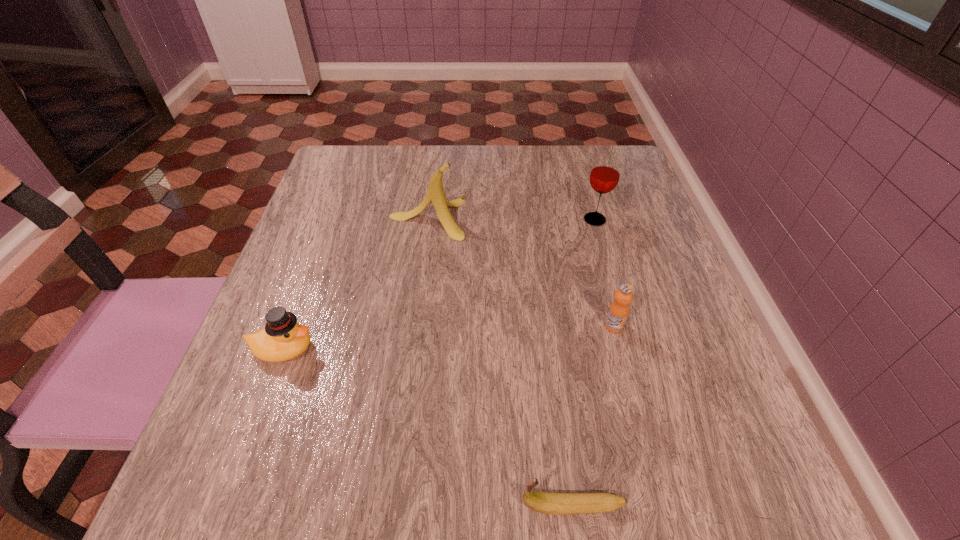
I want to click on free space at the near edge of the desktop, so [x=612, y=522].

Identify the location of free space at the left edge of the desktop. (238, 429).

Find the location of `vacant area at the right edge`. vacant area at the right edge is located at coordinates [656, 340].

This screenshot has height=540, width=960. I want to click on vacant space at the far left corner of the desktop, so click(376, 194).

Where is `blank space at the far right corner of the desktop`? This screenshot has width=960, height=540. blank space at the far right corner of the desktop is located at coordinates (579, 179).

What are the coordinates of `vacant area at the near right corner of the desktop` in the screenshot? It's located at (688, 500).

The height and width of the screenshot is (540, 960). I want to click on vacant space that's between the second object from left to right and the glass, so click(x=511, y=219).

Where is `blank region between the nearer banana and the farther banana`? Image resolution: width=960 pixels, height=540 pixels. blank region between the nearer banana and the farther banana is located at coordinates (500, 362).

Locate an element on the screen. This screenshot has height=540, width=960. vacant point located between the leftmost object and the right banana is located at coordinates (428, 428).

Image resolution: width=960 pixels, height=540 pixels. I want to click on empty location between the orange juice and the glass, so pos(604,273).